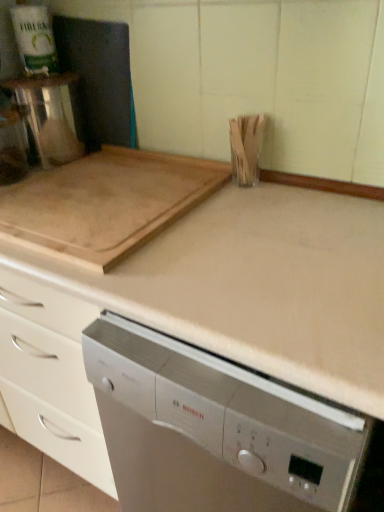
Question: From a real-world perspective, is satin silver dishwasher at center physically located above or below natural wood cutting board at upper left?

Choices:
 (A) below
 (B) above

Answer: (A)

Question: Is satin silver dishwasher at center taller or shorter than natural wood cutting board at upper left?

Choices:
 (A) short
 (B) tall

Answer: (B)

Question: From the image's perspective, is satin silver dishwasher at center above or below natural wood cutting board at upper left?

Choices:
 (A) above
 (B) below

Answer: (B)

Question: From a real-world perspective, is natural wood cutting board at upper left above or below satin silver dishwasher at center?

Choices:
 (A) below
 (B) above

Answer: (B)

Question: From the image's perspective, is natural wood cutting board at upper left above or below satin silver dishwasher at center?

Choices:
 (A) below
 (B) above

Answer: (B)

Question: Would you say natural wood cutting board at upper left is to the left or to the right of satin silver dishwasher at center in the picture?

Choices:
 (A) right
 (B) left

Answer: (B)

Question: Is natural wood cutting board at upper left inside or outside of satin silver dishwasher at center?

Choices:
 (A) inside
 (B) outside

Answer: (B)